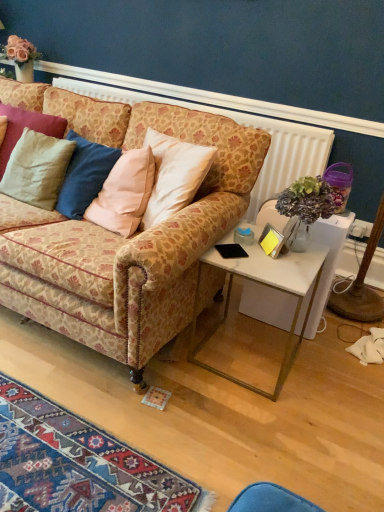
Question: Considering the relative positions of matte beige pillow at left, the 2th pillow positioned from the bottom, and patterned fabric couch at center in the image provided, is matte beige pillow at left, the 2th pillow positioned from the bottom, to the left or to the right of patterned fabric couch at center?

Choices:
 (A) left
 (B) right

Answer: (A)

Question: In terms of height, does matte beige pillow at left, the 2th pillow positioned from the bottom, look taller or shorter compared to patterned fabric couch at center?

Choices:
 (A) short
 (B) tall

Answer: (A)

Question: Which is farther from the matte beige pillow at left, which appears as the 1th pillow when viewed from the top?

Choices:
 (A) patterned fabric couch at center
 (B) white marble desk at right
 (C) white marble side table at right
 (D) matte beige pillow at left, positioned as the 1th pillow in bottom-to-top order

Answer: (B)

Question: Estimate the real-world distances between objects in this image. Which object is closer to the white marble side table at right?

Choices:
 (A) white marble desk at right
 (B) matte beige pillow at left, which appears as the 1th pillow when viewed from the top
 (C) matte beige pillow at left, positioned as the 1th pillow in bottom-to-top order
 (D) patterned fabric couch at center

Answer: (A)